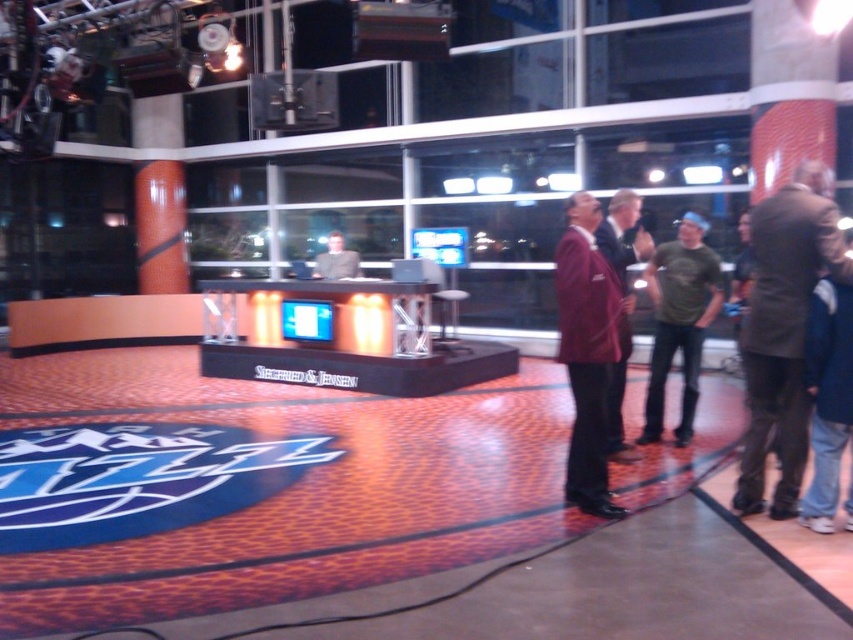
Question: Among these points, which one is farthest from the camera?

Choices:
 (A) (338, 243)
 (B) (595, 445)

Answer: (A)

Question: Among these points, which one is nearest to the camera?

Choices:
 (A) (316, 275)
 (B) (608, 417)
 (C) (653, 257)
 (D) (791, 493)

Answer: (D)

Question: Can you confirm if dark brown leather jacket at right is positioned above matte gray suit at center?

Choices:
 (A) no
 (B) yes

Answer: (A)

Question: Is the position of dark brown leather jacket at right less distant than that of matte gray suit at center?

Choices:
 (A) yes
 (B) no

Answer: (A)

Question: Can you confirm if green matte t-shirt at center is positioned above maroon wool suit at center?

Choices:
 (A) no
 (B) yes

Answer: (B)

Question: Which object is positioned closest to the maroon fabric suit at right?

Choices:
 (A) dark brown leather jacket at right
 (B) green matte t-shirt at center

Answer: (A)